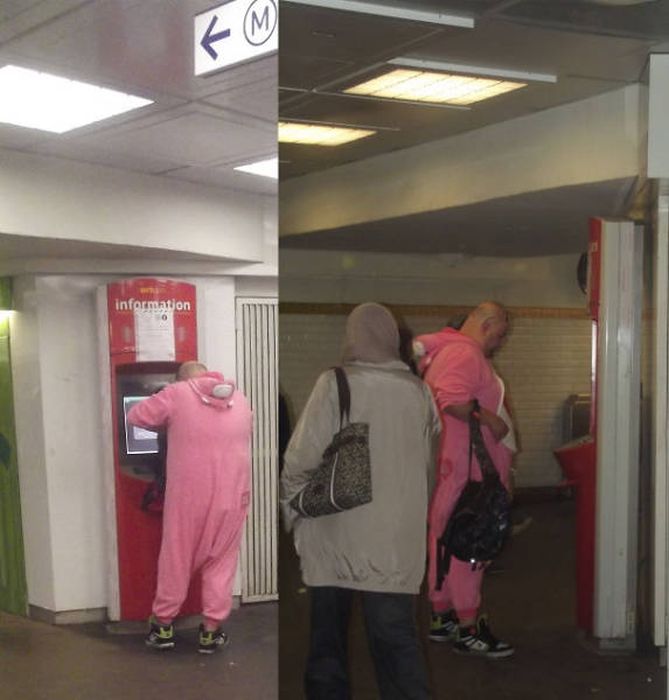
Where is `ag;'r32ceiling light`? ag;'r32ceiling light is located at coordinates (47, 85), (302, 136), (448, 90), (263, 164).